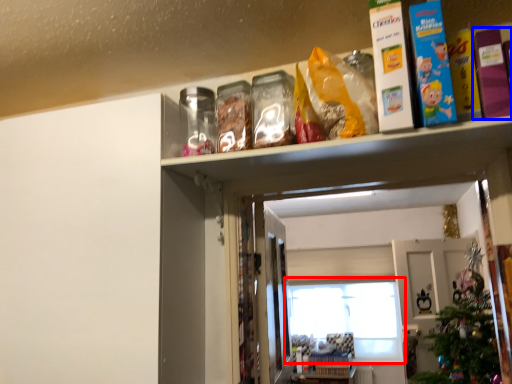
Question: Which object is closer to the camera taking this photo, window (highlighted by a red box) or book (highlighted by a blue box)?

Choices:
 (A) window
 (B) book

Answer: (B)